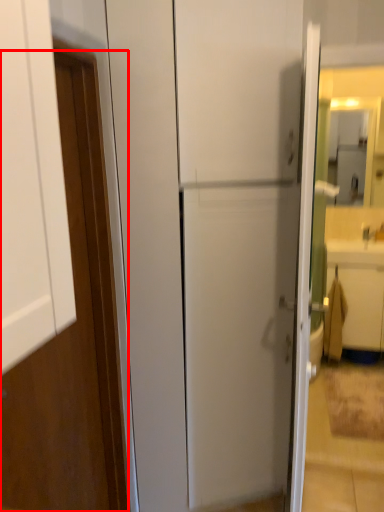
Question: In this image, where is door (annotated by the red box) located relative to drawer?

Choices:
 (A) left
 (B) right

Answer: (A)